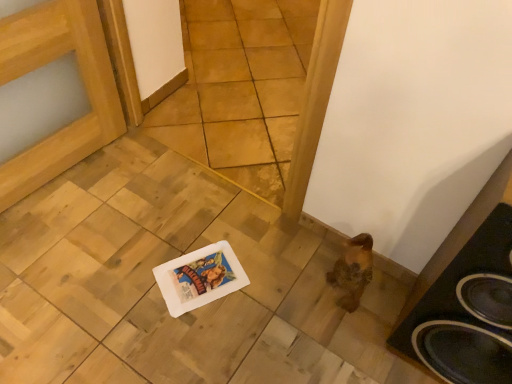
What do you see at coordinates (240, 89) in the screenshot?
I see `natural wood tile at center` at bounding box center [240, 89].

This screenshot has width=512, height=384. In order to click on natural wood tile at center in this screenshot , I will do `click(240, 89)`.

Measure the distance between point (246, 62) and camera.

A distance of 2.37 meters exists between point (246, 62) and camera.

Find the location of a particular element. black matte speaker at lower right is located at coordinates (467, 311).

In order to face black matte speaker at lower right, should I rotate leftwards or rightwards?

It's best to rotate right around 30.892 degrees.

This screenshot has width=512, height=384. What do you see at coordinates (467, 311) in the screenshot?
I see `black matte speaker at lower right` at bounding box center [467, 311].

At what (x,y) coordinates should I click in order to perform the action: click on natural wood tile at center. Please return your answer as a coordinate pair (x, y). Looking at the image, I should click on (240, 89).

Considering the positions of objects natural wood tile at center and black matte speaker at lower right in the image provided, who is more to the left, natural wood tile at center or black matte speaker at lower right?

Positioned to the left is natural wood tile at center.

Which object is further away from the camera, natural wood tile at center or black matte speaker at lower right?

natural wood tile at center is behind.

Which point is more distant from viewer, (268, 167) or (490, 315)?

The point (268, 167) is farther from the camera.

Consider the image. From the image's perspective, between natural wood tile at center and black matte speaker at lower right, which one is located above?

natural wood tile at center, from the image's perspective.

From a real-world perspective, which object rests below the other?

black matte speaker at lower right, from a real-world perspective.

Can you confirm if natural wood tile at center is thinner than black matte speaker at lower right?

Yes, natural wood tile at center is thinner than black matte speaker at lower right.

Can you confirm if natural wood tile at center is taller than black matte speaker at lower right?

Yes.

Considering the sizes of objects natural wood tile at center and black matte speaker at lower right in the image provided, who is bigger, natural wood tile at center or black matte speaker at lower right?

natural wood tile at center.

Would you say natural wood tile at center is outside black matte speaker at lower right?

Yes, natural wood tile at center is outside of black matte speaker at lower right.

Would you say natural wood tile at center is a long distance from black matte speaker at lower right?

Yes, natural wood tile at center is far from black matte speaker at lower right.

Is natural wood tile at center facing away from black matte speaker at lower right?

No, black matte speaker at lower right is not at the back of natural wood tile at center.

Image resolution: width=512 pixels, height=384 pixels. I want to click on tile that appears above the black matte speaker at lower right (from the image's perspective), so click(240, 89).

Considering the relative positions of black matte speaker at lower right and natural wood tile at center in the image provided, is black matte speaker at lower right to the left or to the right of natural wood tile at center?

black matte speaker at lower right is to the right of natural wood tile at center.

Which is behind, black matte speaker at lower right or natural wood tile at center?

Positioned behind is natural wood tile at center.

Which is in front, point (505, 211) or point (260, 184)?

The point (505, 211) is closer to the camera.

Based on the photo, from the image's perspective, is black matte speaker at lower right beneath natural wood tile at center?

Indeed, from the image's perspective, black matte speaker at lower right is shown beneath natural wood tile at center.

From a real-world perspective, is black matte speaker at lower right over natural wood tile at center?

Incorrect, from a real-world perspective, black matte speaker at lower right is lower than natural wood tile at center.

Is black matte speaker at lower right wider than natural wood tile at center?

Correct, the width of black matte speaker at lower right exceeds that of natural wood tile at center.

Between black matte speaker at lower right and natural wood tile at center, which one has more height?

Standing taller between the two is natural wood tile at center.

Considering the relative sizes of black matte speaker at lower right and natural wood tile at center in the image provided, is black matte speaker at lower right smaller than natural wood tile at center?

Correct, black matte speaker at lower right occupies less space than natural wood tile at center.

Is black matte speaker at lower right spatially inside natural wood tile at center, or outside of it?

black matte speaker at lower right is not enclosed by natural wood tile at center.

Is the surface of black matte speaker at lower right in direct contact with natural wood tile at center?

No, black matte speaker at lower right is not next to natural wood tile at center.

Is black matte speaker at lower right oriented towards natural wood tile at center?

No, black matte speaker at lower right is not oriented towards natural wood tile at center.

This screenshot has height=384, width=512. Find the location of `speaker to the right of natural wood tile at center`. speaker to the right of natural wood tile at center is located at coordinates (467, 311).

In the image, there is a natural wood tile at center. At what (x,y) coordinates should I click in order to perform the action: click on speaker below it (from the image's perspective). Please return your answer as a coordinate pair (x, y). The image size is (512, 384). Looking at the image, I should click on (467, 311).

The image size is (512, 384). What are the coordinates of `speaker that appears below the natural wood tile at center (from a real-world perspective)` in the screenshot? It's located at (467, 311).